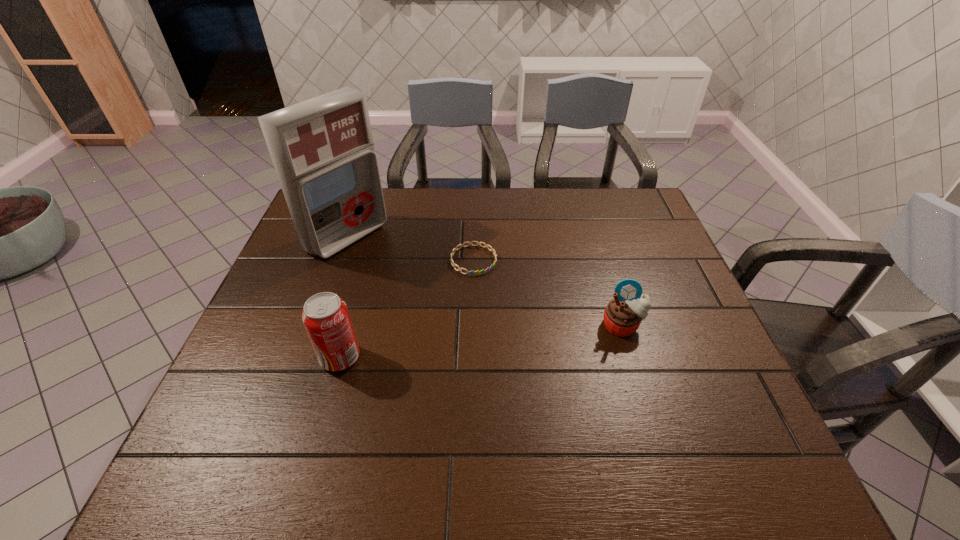
At what (x,y) coordinates should I click in order to perform the action: click on the nearest object. Please return your answer as a coordinate pair (x, y). The height and width of the screenshot is (540, 960). Looking at the image, I should click on (326, 318).

Find the location of a particular element. the third shortest object is located at coordinates (326, 318).

The image size is (960, 540). In order to click on the second shortest object in this screenshot , I will do `click(622, 316)`.

Locate an element on the screen. muffin is located at coordinates (622, 316).

At what (x,y) coordinates should I click in order to perform the action: click on the first-aid kit. Please return your answer as a coordinate pair (x, y). Looking at the image, I should click on (322, 149).

Where is `bracelet`? This screenshot has height=540, width=960. bracelet is located at coordinates (477, 272).

The image size is (960, 540). What are the coordinates of `the third object from left to right` in the screenshot? It's located at (477, 272).

Where is `free region located on the logo side of the nearest object`? Image resolution: width=960 pixels, height=540 pixels. free region located on the logo side of the nearest object is located at coordinates (290, 357).

Find the location of a particular element. vacant area situated 0.060m on the logo side of the nearest object is located at coordinates (295, 357).

The height and width of the screenshot is (540, 960). In order to click on vacant space located on the logo side of the nearest object in this screenshot , I will do `click(247, 357)`.